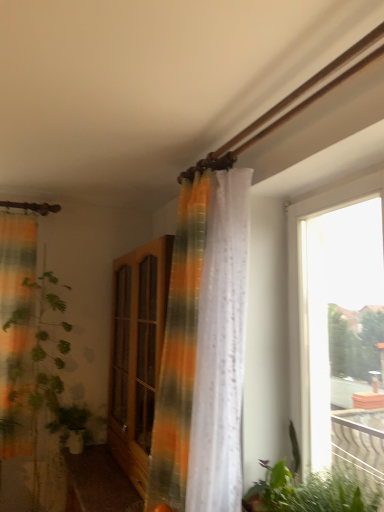
Question: Considering the relative positions of wooden cabinet at center and transparent glass window at right in the image provided, is wooden cabinet at center to the left of transparent glass window at right from the viewer's perspective?

Choices:
 (A) no
 (B) yes

Answer: (B)

Question: Does wooden cabinet at center come behind transparent glass window at right?

Choices:
 (A) yes
 (B) no

Answer: (A)

Question: Considering the relative sizes of wooden cabinet at center and transparent glass window at right in the image provided, is wooden cabinet at center thinner than transparent glass window at right?

Choices:
 (A) no
 (B) yes

Answer: (A)

Question: From a real-world perspective, is wooden cabinet at center on top of transparent glass window at right?

Choices:
 (A) no
 (B) yes

Answer: (A)

Question: Can you confirm if wooden cabinet at center is positioned to the right of transparent glass window at right?

Choices:
 (A) yes
 (B) no

Answer: (B)

Question: In terms of width, does green leafy plant at lower right, the 2th vegetation from the back, look wider or thinner when compared to translucent orange-green curtain at center?

Choices:
 (A) wide
 (B) thin

Answer: (B)

Question: Considering their positions, is green leafy plant at lower right, marked as the 1th vegetation in a front-to-back arrangement, located in front of or behind translucent orange-green curtain at center?

Choices:
 (A) behind
 (B) front

Answer: (B)

Question: From a real-world perspective, is green leafy plant at lower right, which ranks as the 1th vegetation in right-to-left order, physically located above or below translucent orange-green curtain at center?

Choices:
 (A) above
 (B) below

Answer: (B)

Question: Considering the positions of green leafy plant at lower right, the second vegetation positioned from the left, and translucent orange-green curtain at center in the image, is green leafy plant at lower right, the second vegetation positioned from the left, taller or shorter than translucent orange-green curtain at center?

Choices:
 (A) short
 (B) tall

Answer: (A)

Question: Is point (283, 480) positioned closer to the camera than point (77, 507)?

Choices:
 (A) closer
 (B) farther

Answer: (A)

Question: Looking at their shapes, would you say green leafy plant at lower right, the second vegetation positioned from the left, is wider or thinner than wooden cabinet at center?

Choices:
 (A) thin
 (B) wide

Answer: (A)

Question: Considering the positions of green leafy plant at lower right, which ranks as the 1th vegetation in right-to-left order, and wooden cabinet at center in the image, is green leafy plant at lower right, which ranks as the 1th vegetation in right-to-left order, taller or shorter than wooden cabinet at center?

Choices:
 (A) short
 (B) tall

Answer: (A)

Question: From the image's perspective, relative to wooden cabinet at center, is green leafy plant at lower right, marked as the 1th vegetation in a front-to-back arrangement, above or below?

Choices:
 (A) below
 (B) above

Answer: (B)

Question: From a real-world perspective, is wooden cabinet at center above or below wooden cabinet at center?

Choices:
 (A) above
 (B) below

Answer: (A)

Question: Is wooden cabinet at center inside or outside of wooden cabinet at center?

Choices:
 (A) inside
 (B) outside

Answer: (B)